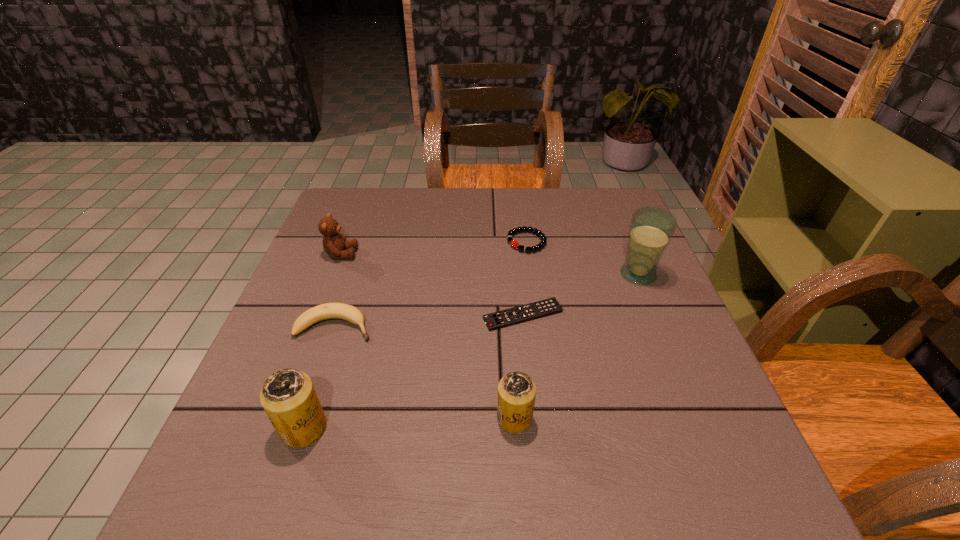
I want to click on vacant place for an extra beer can on the right, so click(717, 408).